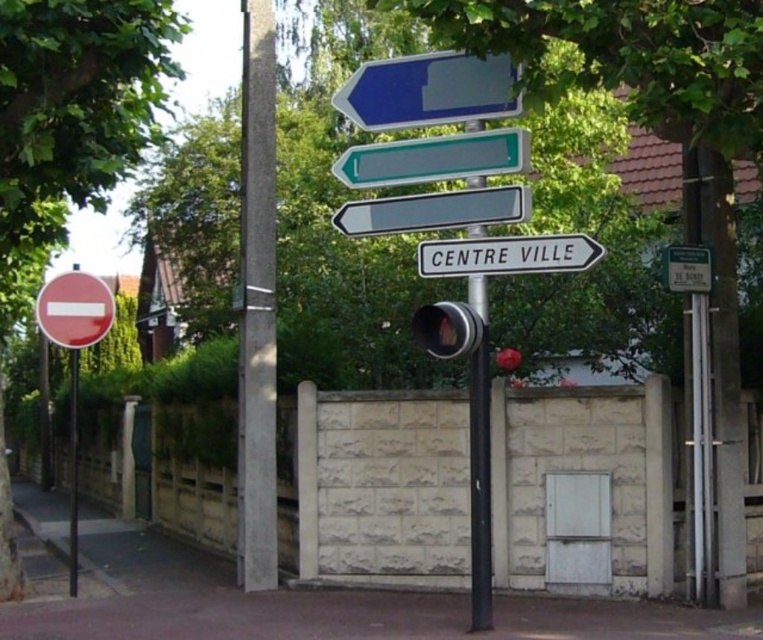
Question: Does concrete pole at center have a larger size compared to black plastic sign at center?

Choices:
 (A) no
 (B) yes

Answer: (B)

Question: Is green leafy tree at left smaller than black metal pole at center?

Choices:
 (A) yes
 (B) no

Answer: (B)

Question: Which object is closer to the camera taking this photo?

Choices:
 (A) black metal pole at center
 (B) blue glossy sign at upper center
 (C) matte red sign at left
 (D) green plastic sign at upper right

Answer: (B)

Question: Which object appears closest to the camera in this image?

Choices:
 (A) green leafy tree at left
 (B) blue glossy sign at upper center

Answer: (B)

Question: Which point appears closest to the camera in this image?

Choices:
 (A) (438, 259)
 (B) (43, 16)
 (C) (684, 248)

Answer: (A)

Question: Is green plastic sign at upper right above metallic pole at left?

Choices:
 (A) yes
 (B) no

Answer: (A)